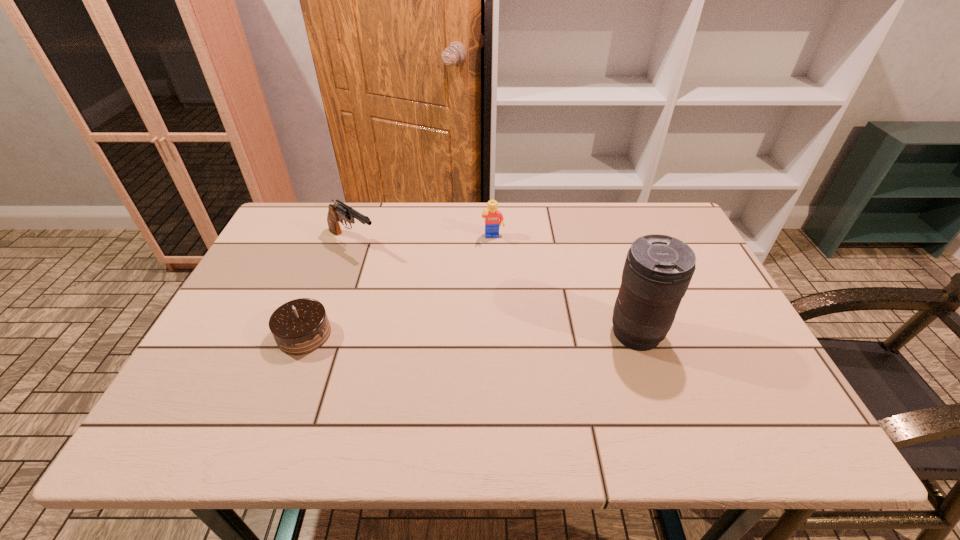
You are a GUI agent. You are given a task and a screenshot of the screen. Output one action in this format:
    pyautogui.click(x=<x>, y=<y>)
    Task: Click on the free space located 0.090m on the face of the second object from right to left
    
    Given the screenshot: What is the action you would take?
    pyautogui.click(x=496, y=262)

The width and height of the screenshot is (960, 540). I want to click on free space located 0.150m on the face of the second object from right to left, so click(499, 276).

You are a GUI agent. You are given a task and a screenshot of the screen. Output one action in this format:
    pyautogui.click(x=<x>, y=<y>)
    Task: Click on the free space located along the barrel of the gun
    This screenshot has width=960, height=540.
    Given the screenshot: What is the action you would take?
    pyautogui.click(x=406, y=275)

The width and height of the screenshot is (960, 540). Identify the location of free space located along the barrel of the gun. (448, 302).

This screenshot has height=540, width=960. I want to click on vacant region located 0.100m along the barrel of the gun, so click(x=395, y=268).

Where is `Lego present at the far edge`? Lego present at the far edge is located at coordinates (492, 215).

You are a GUI agent. You are given a task and a screenshot of the screen. Output one action in this format:
    pyautogui.click(x=<x>, y=<y>)
    Task: Click on the gun at the far edge
    This screenshot has height=540, width=960.
    Given the screenshot: What is the action you would take?
    pyautogui.click(x=337, y=212)

Locate an element on the screen. This screenshot has width=960, height=540. object at the left edge is located at coordinates (300, 326).

The height and width of the screenshot is (540, 960). In order to click on vacant space at the far edge of the desktop in this screenshot , I will do `click(490, 239)`.

This screenshot has height=540, width=960. Find the location of `free space at the near edge of the desktop`. free space at the near edge of the desktop is located at coordinates (348, 375).